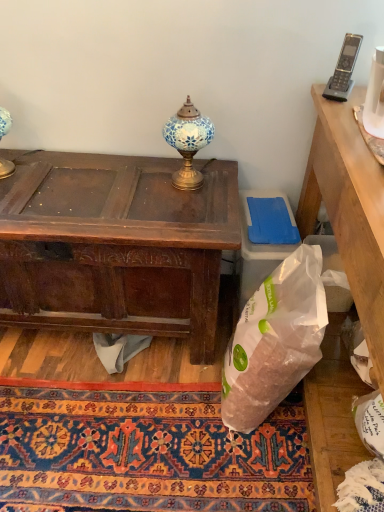
This screenshot has width=384, height=512. What do you see at coordinates (274, 340) in the screenshot?
I see `translucent white plastic bag at lower right` at bounding box center [274, 340].

Locate an element on the screen. This screenshot has height=512, width=384. white plastic trash bin/can at lower right is located at coordinates (260, 244).

Measure the distance between carpet with intricate patterns at lower center and camera.

A distance of 3.73 feet exists between carpet with intricate patterns at lower center and camera.

At what (x,y) coordinates should I click in order to perform the action: click on blue mosaic lamp at center. Please return your answer as a coordinate pair (x, y). Looking at the image, I should click on (188, 143).

This screenshot has height=512, width=384. Identify the location of corded phone above the white plastic trash bin/can at lower right (from the image's perspective). (344, 69).

From a real-world perspective, is gray plastic phone at upper right located higher than white plastic trash bin/can at lower right?

Yes.

Is gray plastic phone at upper right with white plastic trash bin/can at lower right?

There is a gap between gray plastic phone at upper right and white plastic trash bin/can at lower right.

How distant is gray plastic phone at upper right from white plastic trash bin/can at lower right?

gray plastic phone at upper right and white plastic trash bin/can at lower right are 18.88 inches apart from each other.

Is carpet with intricate patterns at lower center oriented away from gray plastic phone at upper right?

No, carpet with intricate patterns at lower center is not facing away from gray plastic phone at upper right.

Between carpet with intricate patterns at lower center and gray plastic phone at upper right, which one has less height?

carpet with intricate patterns at lower center is shorter.

Consider the image. Does carpet with intricate patterns at lower center have a lesser width compared to gray plastic phone at upper right?

No.

Is white plastic trash bin/can at lower right closer to the viewer compared to gray plastic phone at upper right?

No, white plastic trash bin/can at lower right is further to the viewer.

Image resolution: width=384 pixels, height=512 pixels. Identify the location of trash bin/can below the gray plastic phone at upper right (from a real-world perspective). (260, 244).

Based on their positions, is white plastic trash bin/can at lower right located to the left or right of gray plastic phone at upper right?

white plastic trash bin/can at lower right is to the left of gray plastic phone at upper right.

Which of these two, gray plastic phone at upper right or translucent white plastic bag at lower right, stands taller?

translucent white plastic bag at lower right.

Considering the relative positions of gray plastic phone at upper right and translucent white plastic bag at lower right in the image provided, is gray plastic phone at upper right to the left of translucent white plastic bag at lower right from the viewer's perspective?

Incorrect, gray plastic phone at upper right is not on the left side of translucent white plastic bag at lower right.

Can you confirm if gray plastic phone at upper right is wider than translucent white plastic bag at lower right?

In fact, gray plastic phone at upper right might be narrower than translucent white plastic bag at lower right.

Considering the relative positions of carpet with intricate patterns at lower center and dark brown wood desk at center in the image provided, is carpet with intricate patterns at lower center to the left of dark brown wood desk at center from the viewer's perspective?

No, carpet with intricate patterns at lower center is not to the left of dark brown wood desk at center.

Could you measure the distance between carpet with intricate patterns at lower center and dark brown wood desk at center?

carpet with intricate patterns at lower center is 17.75 inches away from dark brown wood desk at center.

The image size is (384, 512). In order to click on mat in front of the dark brown wood desk at center in this screenshot , I will do pos(147,453).

Is carpet with intricate patterns at lower center oriented away from dark brown wood desk at center?

No, dark brown wood desk at center is not at the back of carpet with intricate patterns at lower center.

Locate an element on the screen. mat on the left of white plastic trash bin/can at lower right is located at coordinates (147, 453).

Can you confirm if carpet with intricate patterns at lower center is taller than white plastic trash bin/can at lower right?

In fact, carpet with intricate patterns at lower center may be shorter than white plastic trash bin/can at lower right.

Is carpet with intricate patterns at lower center wider or thinner than white plastic trash bin/can at lower right?

Clearly, carpet with intricate patterns at lower center has more width compared to white plastic trash bin/can at lower right.

From a real-world perspective, who is located lower, carpet with intricate patterns at lower center or white plastic trash bin/can at lower right?

carpet with intricate patterns at lower center, from a real-world perspective.

Is translucent white plastic bag at lower right looking in the opposite direction of blue mosaic lamp at center?

No, translucent white plastic bag at lower right is not facing away from blue mosaic lamp at center.

What are the coordinates of `plastic bag located underneath the blue mosaic lamp at center (from a real-world perspective)` in the screenshot? It's located at (274, 340).

Are translucent white plastic bag at lower right and blue mosaic lamp at center far apart?

That's not correct — translucent white plastic bag at lower right is a little close to blue mosaic lamp at center.

Locate an element on the screen. The image size is (384, 512). corded phone above the white plastic trash bin/can at lower right (from a real-world perspective) is located at coordinates click(344, 69).

In order to click on mat behind the gray plastic phone at upper right in this screenshot , I will do `click(147, 453)`.

Considering their positions, is gray plastic phone at upper right positioned further to white plastic trash bin/can at lower right than dark brown wood desk at center?

gray plastic phone at upper right is positioned further to the anchor white plastic trash bin/can at lower right.

Estimate the real-world distances between objects in this image. Which object is further from dark brown wood desk at center, carpet with intricate patterns at lower center or gray plastic phone at upper right?

gray plastic phone at upper right is positioned further to the anchor dark brown wood desk at center.

From the image, which object appears to be nearer to gray plastic phone at upper right, white plastic trash bin/can at lower right or translucent white plastic bag at lower right?

Based on the image, white plastic trash bin/can at lower right appears to be nearer to gray plastic phone at upper right.

Which object lies nearer to the anchor point gray plastic phone at upper right, white plastic trash bin/can at lower right or dark brown wood desk at center?

white plastic trash bin/can at lower right lies closer to gray plastic phone at upper right than the other object.

Looking at the image, which one is located closer to carpet with intricate patterns at lower center, gray plastic phone at upper right or blue mosaic lamp at center?

The object closer to carpet with intricate patterns at lower center is blue mosaic lamp at center.

Considering their positions, is blue mosaic lamp at center positioned further to gray plastic phone at upper right than carpet with intricate patterns at lower center?

carpet with intricate patterns at lower center is positioned further to the anchor gray plastic phone at upper right.

Considering their positions, is carpet with intricate patterns at lower center positioned closer to gray plastic phone at upper right than blue mosaic lamp at center?

Based on the image, blue mosaic lamp at center appears to be nearer to gray plastic phone at upper right.

When comparing their distances from translucent white plastic bag at lower right, does white plastic trash bin/can at lower right or carpet with intricate patterns at lower center seem closer?

white plastic trash bin/can at lower right lies closer to translucent white plastic bag at lower right than the other object.

This screenshot has width=384, height=512. What are the coordinates of `lamp between dark brown wood desk at center and translucent white plastic bag at lower right from left to right` in the screenshot? It's located at (188, 143).

At what (x,y) coordinates should I click in order to perform the action: click on trash bin/can between dark brown wood desk at center and gray plastic phone at upper right. Please return your answer as a coordinate pair (x, y). Looking at the image, I should click on (260, 244).

What are the coordinates of `lamp between gray plastic phone at upper right and white plastic trash bin/can at lower right in the vertical direction` in the screenshot? It's located at (188, 143).

I want to click on lamp between dark brown wood desk at center and gray plastic phone at upper right, so click(188, 143).